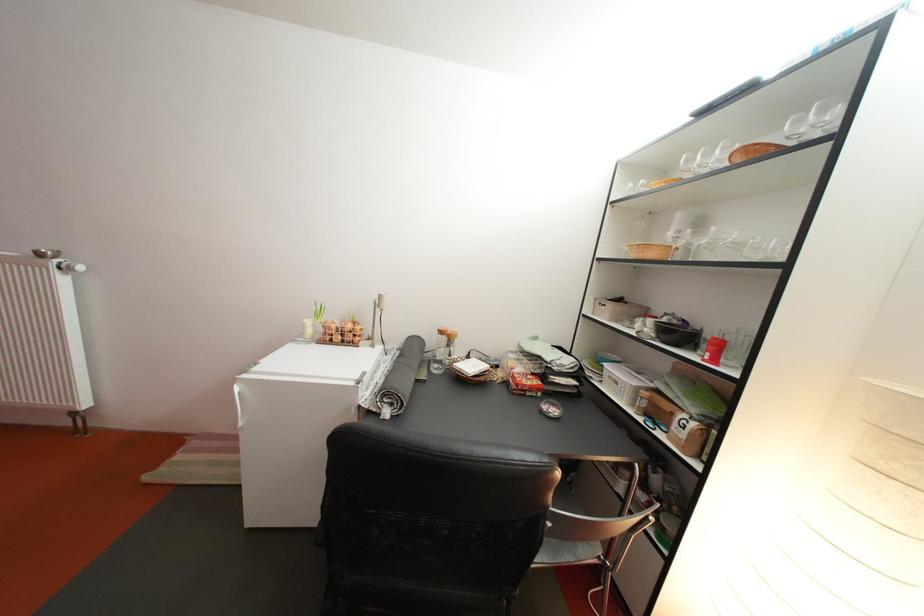
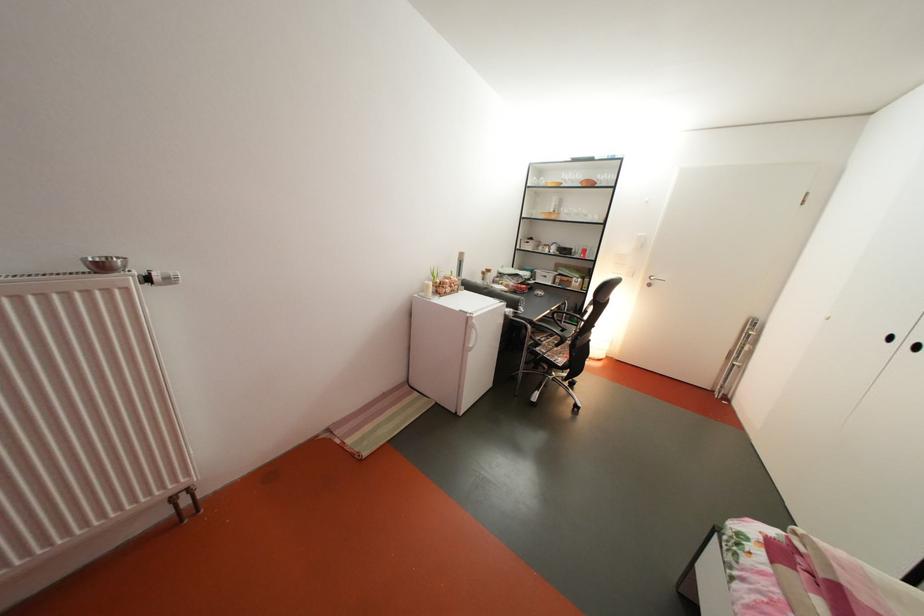
Question: I am providing you with two images of the same scene from different viewpoints. After the viewpoint changes to image2, which objects are now occluded?

Choices:
 (A) grey fabric backpack
 (B) white radiator knob
 (C) radiator thermostat knob
 (D) white refrigerator handle

Answer: (B)